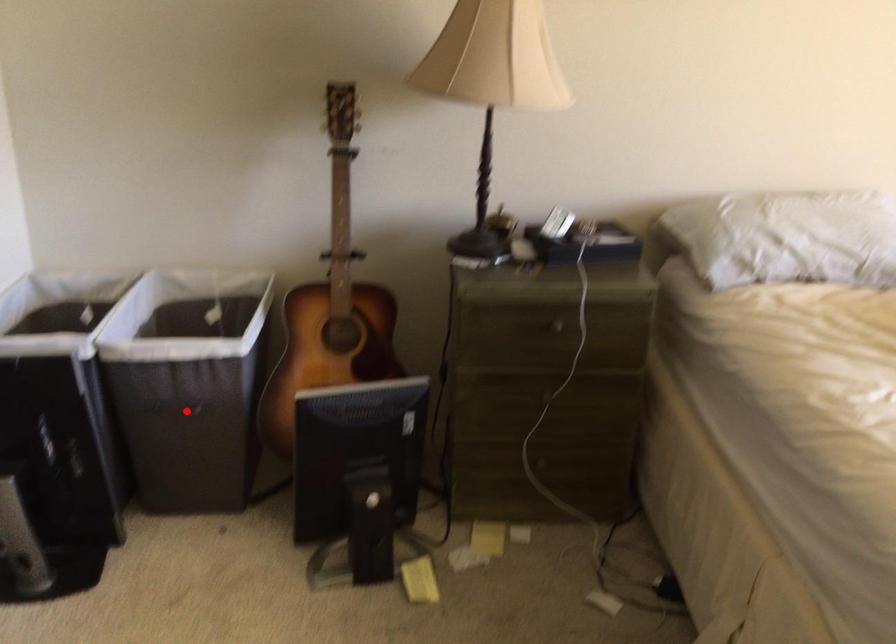
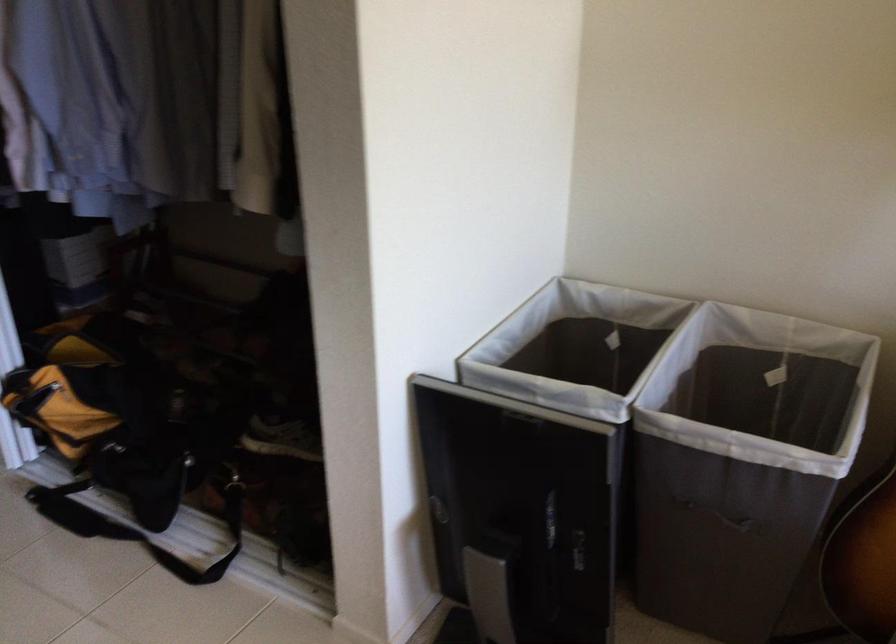
Find the pixel in the second image that matches the highlighted location in the first image.

(719, 516)